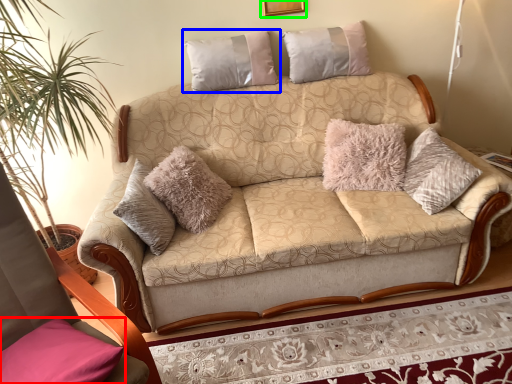
Question: Which is nearer to the pillow (highlighted by a red box)? pillow (highlighted by a blue box) or picture frame (highlighted by a green box).

Choices:
 (A) pillow
 (B) picture frame

Answer: (A)